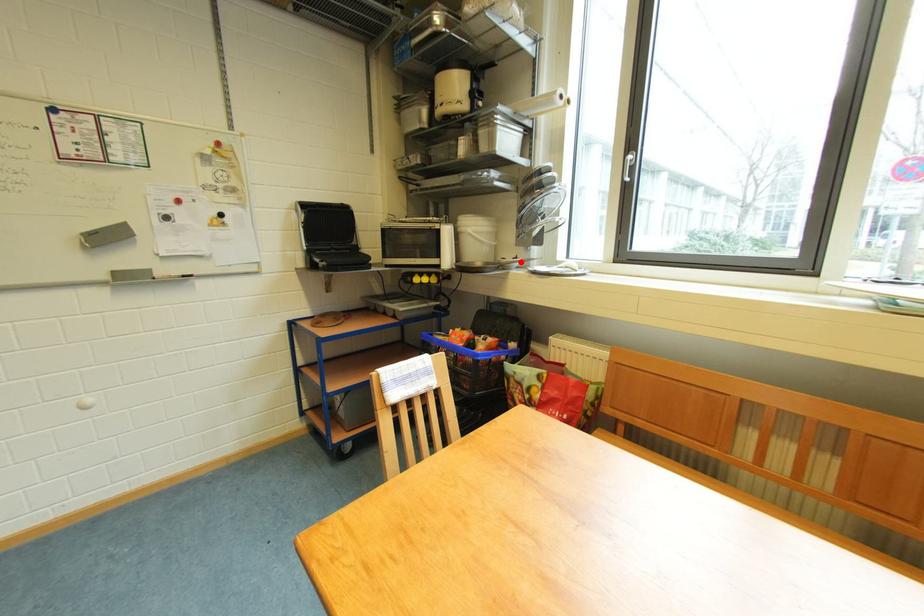
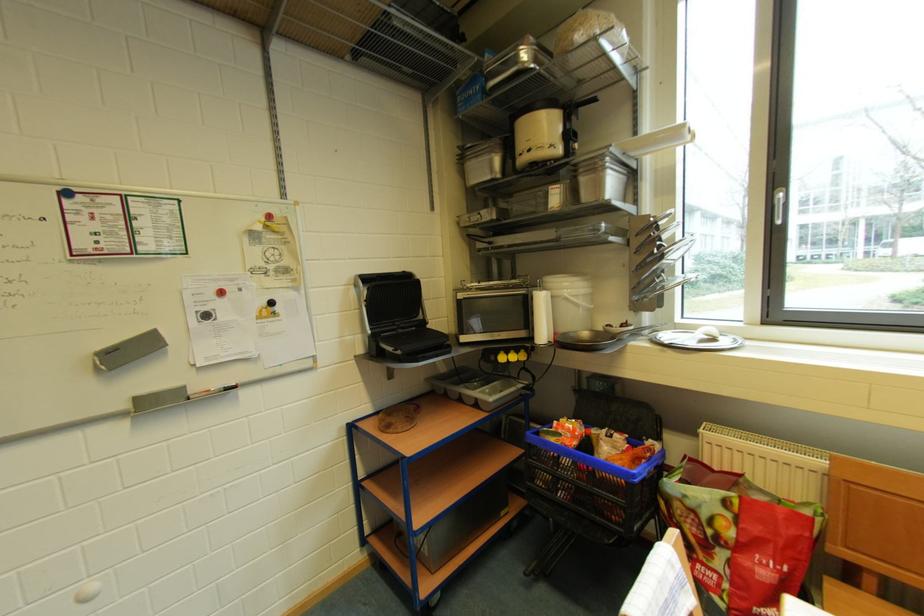
Question: I am providing you with two images of the same scene from different viewpoints. A red point is marked on the first image. Is the red point's position out of view in image 2?

Choices:
 (A) Yes
 (B) No

Answer: (B)